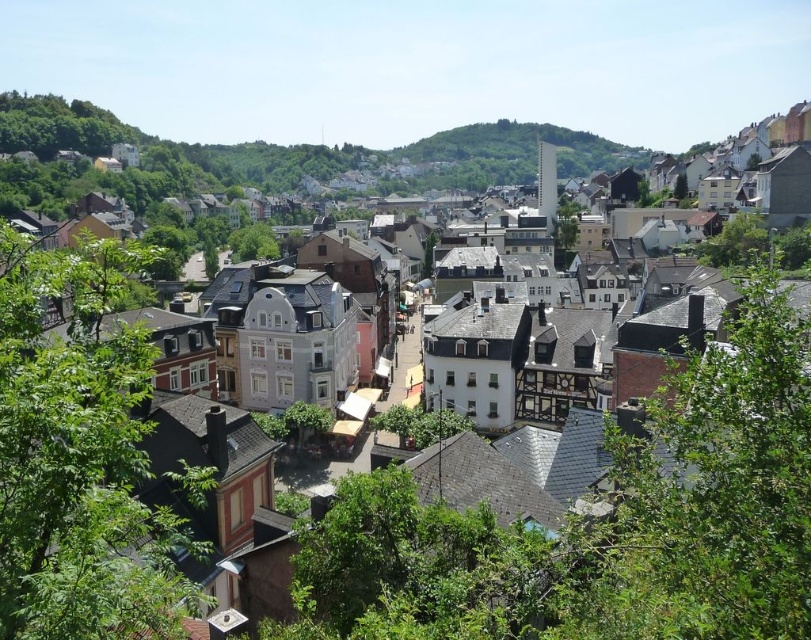
Question: Is green grassy hillside at center above green leafy tree at center?

Choices:
 (A) no
 (B) yes

Answer: (B)

Question: Which of these objects is positioned closest to the green leafy tree at lower left?

Choices:
 (A) green leafy tree at center
 (B) green grassy hillside at center
 (C) green leafy tree at lower right

Answer: (C)

Question: Which of these objects is positioned closest to the green leafy tree at lower right?

Choices:
 (A) green leafy tree at center
 (B) green grassy hillside at center

Answer: (A)

Question: Which of the following is the closest to the observer?

Choices:
 (A) green leafy tree at lower right
 (B) green leafy tree at center

Answer: (A)

Question: Is green leafy tree at lower right wider than green leafy tree at lower left?

Choices:
 (A) yes
 (B) no

Answer: (B)

Question: Does green leafy tree at lower right appear on the right side of green leafy tree at center?

Choices:
 (A) yes
 (B) no

Answer: (A)